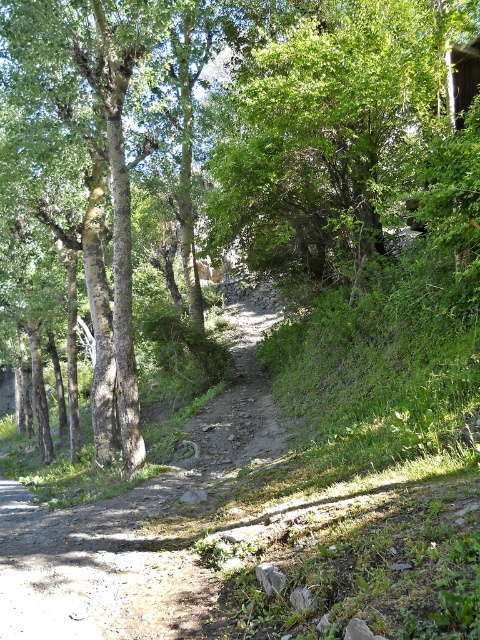
Question: Which object is the closest to the brown rough tree at center?

Choices:
 (A) green leafy tree at upper center
 (B) rough bark tree at left

Answer: (A)

Question: Is brown rough tree at center below rough bark tree at left?

Choices:
 (A) yes
 (B) no

Answer: (B)

Question: Is brown rough tree at center closer to the viewer compared to rough bark tree at left?

Choices:
 (A) no
 (B) yes

Answer: (B)

Question: Which point is farther from the camera taking this photo?

Choices:
 (A) (458, 234)
 (B) (119, 176)
 (C) (300, 136)

Answer: (B)

Question: Which point is farther to the camera?

Choices:
 (A) brown rough tree at center
 (B) green leafy tree at upper center
 (C) rough bark tree at left

Answer: (C)

Question: Is brown rough tree at center positioned before green leafy tree at upper center?

Choices:
 (A) yes
 (B) no

Answer: (B)